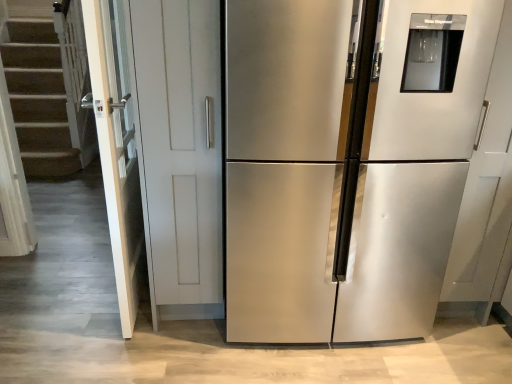
What do you see at coordinates (116, 148) in the screenshot?
I see `white glossy door at left` at bounding box center [116, 148].

Find the location of a particular element. This screenshot has height=384, width=512. white glossy door at left is located at coordinates (116, 148).

Where is `stainless steel refrigerator at center`? The height and width of the screenshot is (384, 512). stainless steel refrigerator at center is located at coordinates (348, 166).

What do you see at coordinates (348, 166) in the screenshot? The height and width of the screenshot is (384, 512). I see `stainless steel refrigerator at center` at bounding box center [348, 166].

Find the location of a particular element. The image size is (512, 384). white glossy door at left is located at coordinates (116, 148).

Considering the relative positions of white glossy door at left and stainless steel refrigerator at center in the image provided, is white glossy door at left to the right of stainless steel refrigerator at center from the viewer's perspective?

No.

Is white glossy door at left positioned before stainless steel refrigerator at center?

No.

Which point is more forward, (109, 81) or (489, 70)?

The point (489, 70) is closer to the camera.

From the image's perspective, which is below, white glossy door at left or stainless steel refrigerator at center?

stainless steel refrigerator at center, from the image's perspective.

From a real-world perspective, is white glossy door at left physically above stainless steel refrigerator at center?

No.

Between white glossy door at left and stainless steel refrigerator at center, which one has larger width?

Wider between the two is stainless steel refrigerator at center.

Does white glossy door at left have a lesser height compared to stainless steel refrigerator at center?

Indeed, white glossy door at left has a lesser height compared to stainless steel refrigerator at center.

Considering the relative sizes of white glossy door at left and stainless steel refrigerator at center in the image provided, is white glossy door at left bigger than stainless steel refrigerator at center?

No.

Is stainless steel refrigerator at center located within white glossy door at left?

No, stainless steel refrigerator at center is not inside white glossy door at left.

In the scene shown: Does white glossy door at left touch stainless steel refrigerator at center?

No, white glossy door at left is not with stainless steel refrigerator at center.

Does white glossy door at left turn towards stainless steel refrigerator at center?

No, white glossy door at left does not turn towards stainless steel refrigerator at center.

Can you tell me how much white glossy door at left and stainless steel refrigerator at center differ in facing direction?

There is a 86.6-degree angle between the facing directions of white glossy door at left and stainless steel refrigerator at center.

How distant is white glossy door at left from stainless steel refrigerator at center?

white glossy door at left and stainless steel refrigerator at center are 31.47 inches apart from each other.

This screenshot has width=512, height=384. What are the coordinates of `refrigerator below the white glossy door at left (from the image's perspective)` in the screenshot? It's located at (348, 166).

Considering the positions of objects stainless steel refrigerator at center and white glossy door at left in the image provided, who is more to the right, stainless steel refrigerator at center or white glossy door at left?

Positioned to the right is stainless steel refrigerator at center.

Consider the image. Is stainless steel refrigerator at center positioned before white glossy door at left?

Yes.

Does point (370, 199) appear closer or farther from the camera than point (106, 66)?

Point (370, 199) appears to be closer to the viewer than point (106, 66).

From the image's perspective, which one is positioned lower, stainless steel refrigerator at center or white glossy door at left?

stainless steel refrigerator at center, from the image's perspective.

From a real-world perspective, is stainless steel refrigerator at center under white glossy door at left?

No, from a real-world perspective, stainless steel refrigerator at center is not below white glossy door at left.

Which object is thinner, stainless steel refrigerator at center or white glossy door at left?

white glossy door at left is thinner.

Is stainless steel refrigerator at center taller than white glossy door at left?

Indeed, stainless steel refrigerator at center has a greater height compared to white glossy door at left.

Can you confirm if stainless steel refrigerator at center is smaller than white glossy door at left?

Actually, stainless steel refrigerator at center might be larger than white glossy door at left.

In the scene shown: Is stainless steel refrigerator at center located outside white glossy door at left?

That's correct, stainless steel refrigerator at center is outside of white glossy door at left.

Would you say stainless steel refrigerator at center is a long distance from white glossy door at left?

No, stainless steel refrigerator at center is not far from white glossy door at left.

Is stainless steel refrigerator at center facing away from white glossy door at left?

No, stainless steel refrigerator at center is not facing the opposite direction of white glossy door at left.

I want to click on door lying behind the stainless steel refrigerator at center, so click(x=116, y=148).

This screenshot has height=384, width=512. Find the location of `door that is on the left side of stainless steel refrigerator at center`. door that is on the left side of stainless steel refrigerator at center is located at coordinates (116, 148).

This screenshot has height=384, width=512. Identify the location of door beneath the stainless steel refrigerator at center (from a real-world perspective). (116, 148).